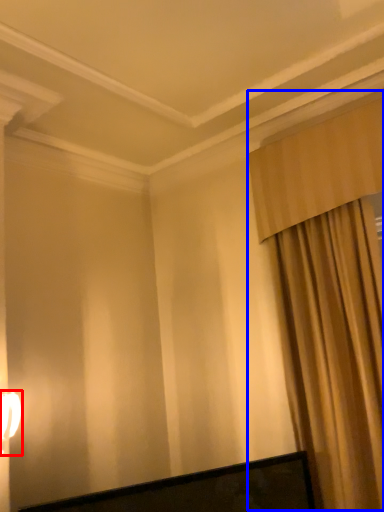
Question: Which of the following is the farthest to the observer, table lamp (highlighted by a red box) or curtain (highlighted by a blue box)?

Choices:
 (A) table lamp
 (B) curtain

Answer: (B)